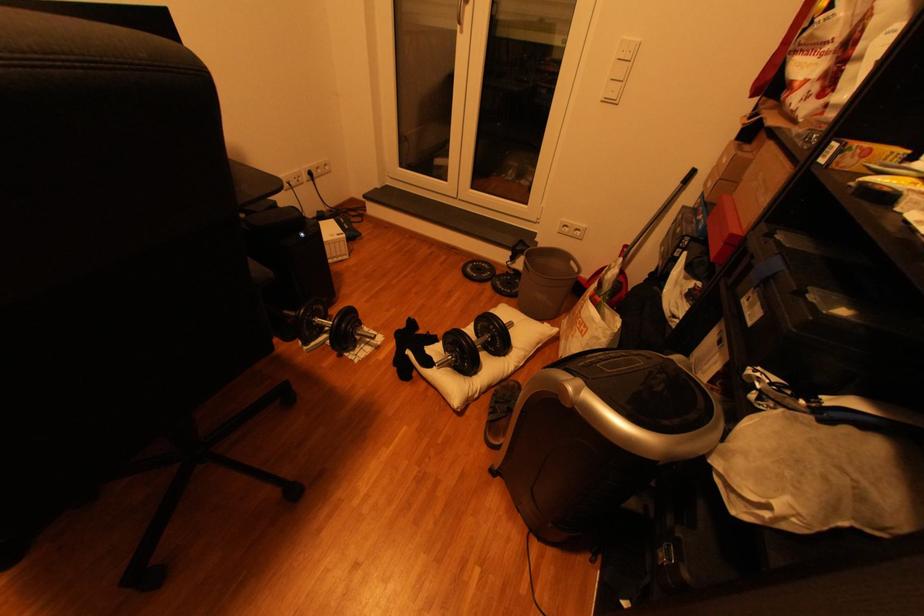
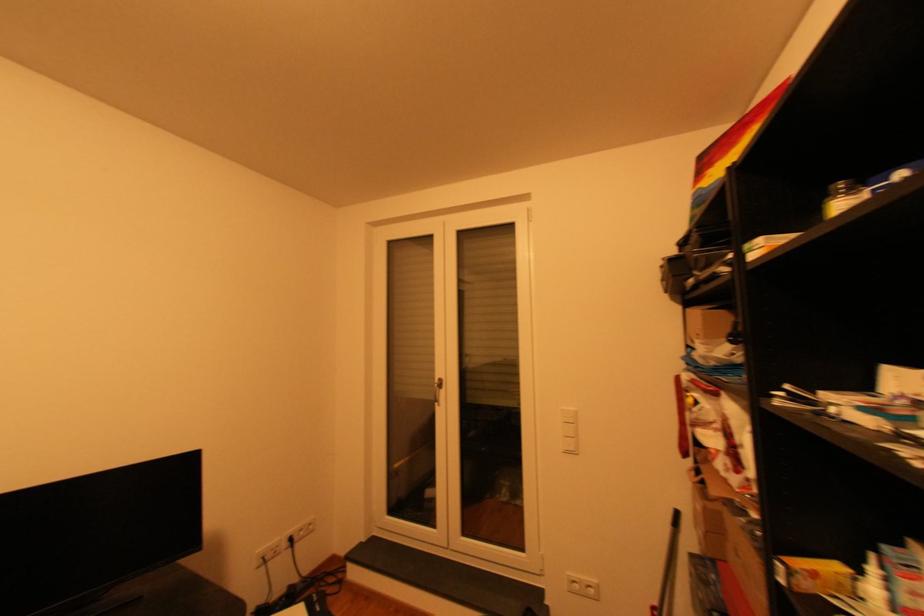
Where in the second image is the point corresponding to point 614,100 from the first image?

(576, 453)